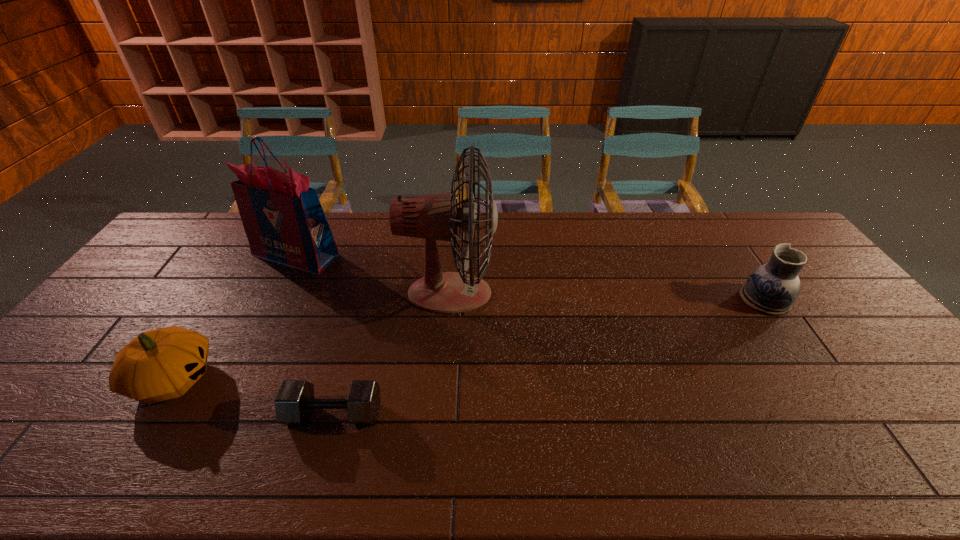
At what (x,y) coordinates should I click in order to perform the action: click on the second object from right to left. Please return your answer as a coordinate pair (x, y). Image resolution: width=960 pixels, height=540 pixels. Looking at the image, I should click on (433, 217).

I want to click on grocery bag, so click(283, 219).

In order to click on the rightmost object in this screenshot , I will do `click(772, 288)`.

Where is `gourd`? gourd is located at coordinates (161, 364).

Where is `the third object from left to right`? This screenshot has height=540, width=960. the third object from left to right is located at coordinates (295, 401).

This screenshot has height=540, width=960. Identify the location of the shortest object. (295, 401).

Identify the location of vacant space positioned in front of the fourth object from left to right to direct airflow. [x=570, y=293].

Locate an element on the screen. free space located 0.080m on the front-facing side of the grocery bag is located at coordinates (276, 292).

The image size is (960, 540). Identify the location of free location located on the left of the rightmost object. (661, 300).

This screenshot has height=540, width=960. I want to click on vacant space located 0.160m on the side of the gourd with the carved face, so click(277, 380).